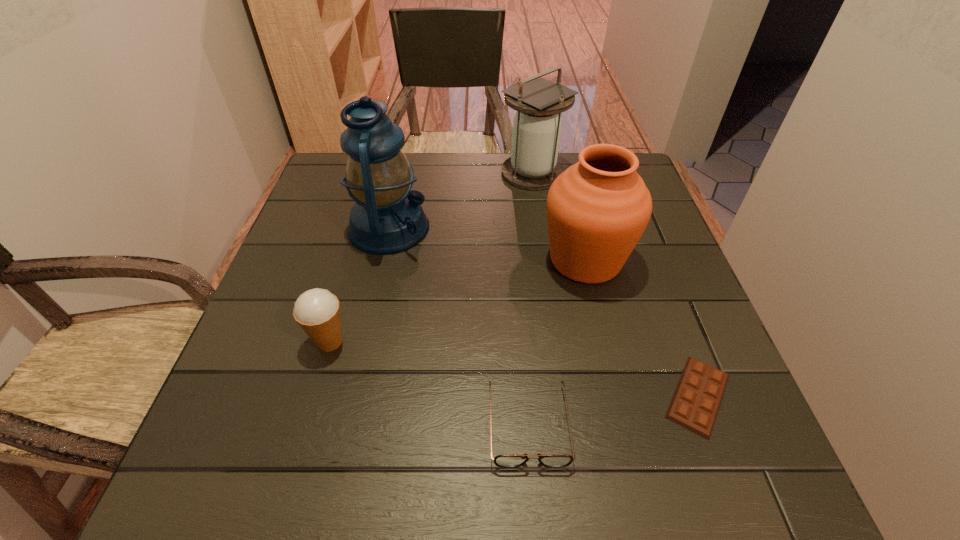
What are the coordinates of `vacant space at the far edge of the desktop` in the screenshot? It's located at (430, 198).

I want to click on vacant space at the near edge of the desktop, so click(x=380, y=477).

I want to click on free space at the left edge, so click(x=291, y=322).

Locate an element on the screen. free spot at the right edge of the desktop is located at coordinates (652, 222).

The height and width of the screenshot is (540, 960). What are the coordinates of `vacant space that's between the farthest object and the shortest object` in the screenshot? It's located at (615, 285).

I want to click on free space between the third shortest object and the nearer lantern, so click(359, 285).

Find the location of a particular element. This screenshot has width=960, height=540. vacant space in between the urn and the shortest object is located at coordinates (641, 328).

You are a GUI agent. You are given a task and a screenshot of the screen. Output one action in this format:
    pyautogui.click(x=<x>, y=<y>)
    Task: Click on the vacant space that is in between the farther lantern and the sunglasses
    The height and width of the screenshot is (540, 960).
    Given the screenshot: What is the action you would take?
    pyautogui.click(x=530, y=299)

The image size is (960, 540). In order to click on unoccupied area between the sunglasses and the icecream in this screenshot , I will do `click(429, 383)`.

This screenshot has width=960, height=540. What are the coordinates of `vacant area that lies between the chocolate bar and the icecream` in the screenshot? It's located at (514, 369).